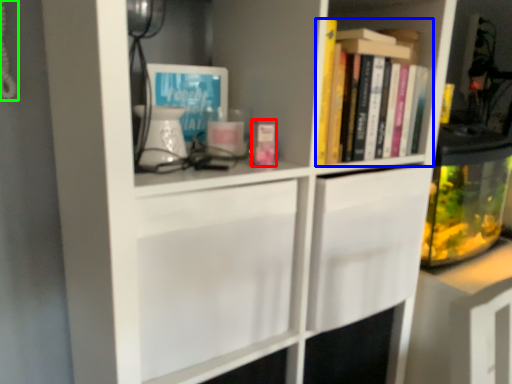
Question: Which object is positioned closest to book (highlighted by a red box)? Select from book (highlighted by a blue box) and corded phone (highlighted by a green box).

Choices:
 (A) book
 (B) corded phone

Answer: (A)